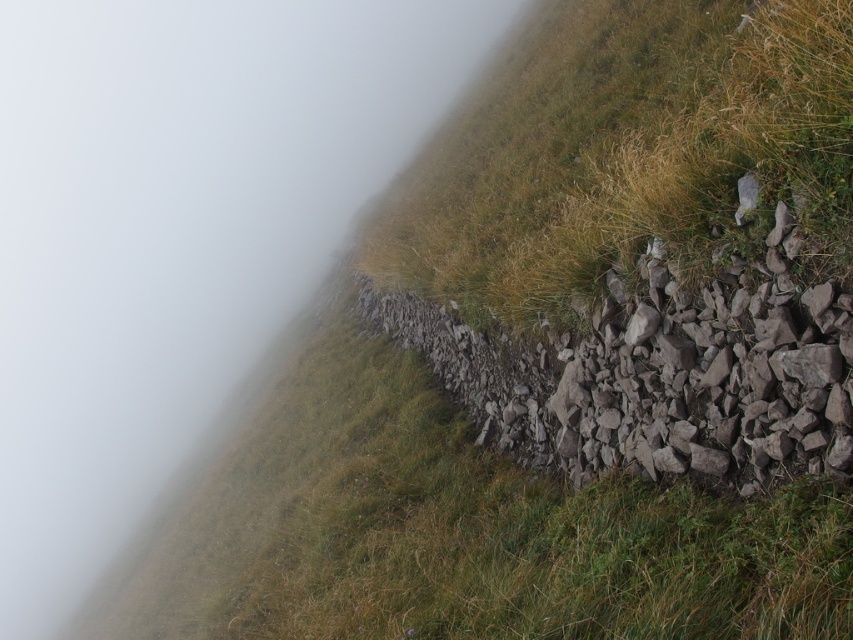
From the picture: You are an artist planning to paint the landscape. You need to decide which area to focus on first based on their sizes. Which object in the scene has a greater width between the white mist at upper left and the gray rough stone at right?

The white mist at upper left has a greater width than the gray rough stone at right according to the description.

You are standing on the grassy slope in the foreground and want to locate the white mist at upper left. According to the coordinates provided, where exactly should you look?

The white mist at upper left is located at the coordinates point (177, 234).

You are an explorer navigating through the misty hills. You see the white mist at upper left and the gray rough stone at right. Which object is closer to you?

The gray rough stone at right is behind the white mist at upper left, so the white mist at upper left is closer to you.